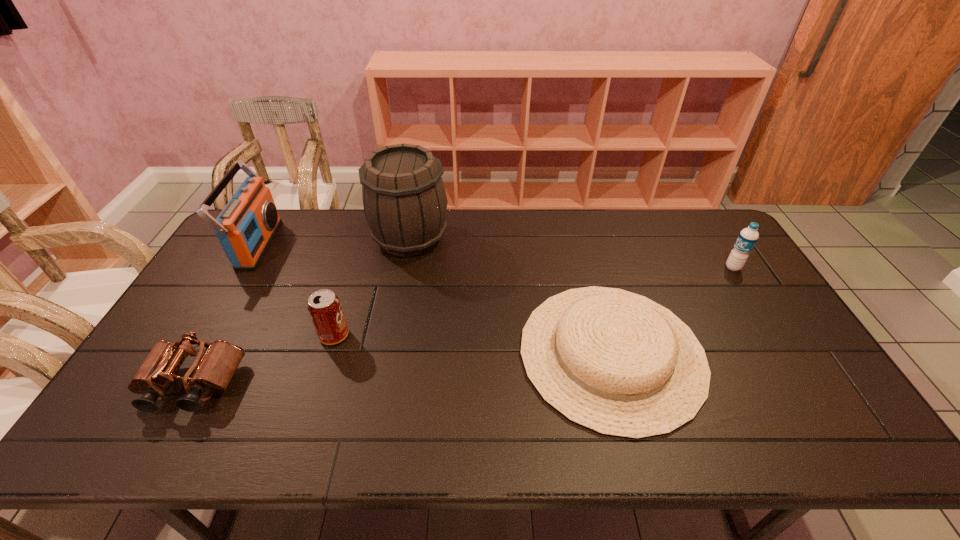
Locate an element on the screen. This screenshot has height=540, width=960. radio receiver present at the left edge is located at coordinates (246, 226).

The width and height of the screenshot is (960, 540). Identify the location of binoculars that is at the left edge. (213, 371).

At what (x,y) coordinates should I click in order to perform the action: click on object situated at the right edge. Please return your answer as a coordinate pair (x, y). This screenshot has width=960, height=540. Looking at the image, I should click on (748, 237).

Locate an element on the screen. Image resolution: width=960 pixels, height=540 pixels. object situated at the far left corner is located at coordinates (246, 226).

What are the coordinates of `object positioned at the near left corner` in the screenshot? It's located at 213,371.

This screenshot has height=540, width=960. What are the coordinates of `vacant space at the far edge of the desktop` in the screenshot? It's located at (468, 235).

The height and width of the screenshot is (540, 960). In the image, there is a desktop. Identify the location of vacant region at the near edge. (404, 446).

Where is `vacant space at the left edge`? This screenshot has height=540, width=960. vacant space at the left edge is located at coordinates (201, 286).

The height and width of the screenshot is (540, 960). I want to click on free region at the right edge, so click(x=768, y=320).

Find the location of a particular element. This screenshot has height=540, width=960. free space between the second object from right to left and the water bottle is located at coordinates (672, 310).